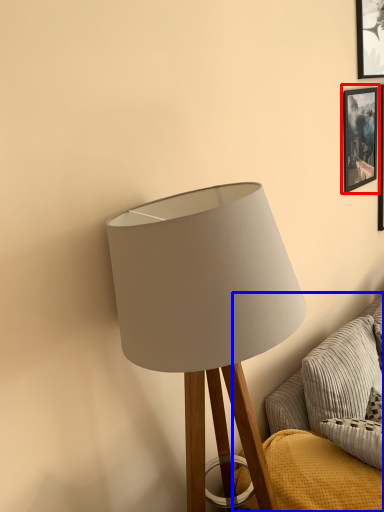
Question: Among these objects, which one is farthest to the camera, picture frame (highlighted by a red box) or couch (highlighted by a blue box)?

Choices:
 (A) picture frame
 (B) couch

Answer: (A)